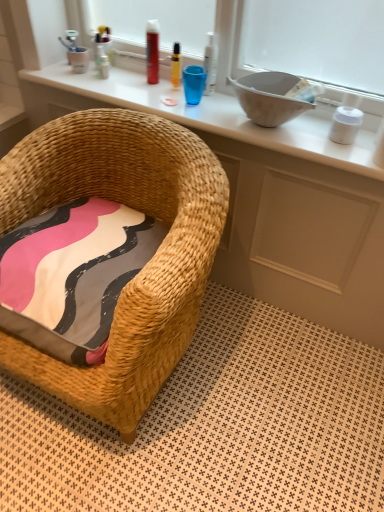
Question: Considering the relative positions of white matte container at upper right, marked as the 1th toiletry in a right-to-left arrangement, and woven wood changing table at upper center in the image provided, is white matte container at upper right, marked as the 1th toiletry in a right-to-left arrangement, to the right of woven wood changing table at upper center from the viewer's perspective?

Choices:
 (A) yes
 (B) no

Answer: (A)

Question: Does white matte container at upper right, which appears as the 5th toiletry when viewed from the left, have a larger size compared to woven wood changing table at upper center?

Choices:
 (A) yes
 (B) no

Answer: (B)

Question: Is white matte container at upper right, which appears as the 5th toiletry when viewed from the left, outside woven wood changing table at upper center?

Choices:
 (A) yes
 (B) no

Answer: (A)

Question: Can you confirm if white matte container at upper right, which appears as the 5th toiletry when viewed from the left, is taller than woven wood changing table at upper center?

Choices:
 (A) no
 (B) yes

Answer: (B)

Question: Are white matte container at upper right, marked as the 1th toiletry in a right-to-left arrangement, and woven wood changing table at upper center far apart?

Choices:
 (A) yes
 (B) no

Answer: (B)

Question: Is woven straw chair at lower left wider or thinner than matte wicker vanity at center?

Choices:
 (A) thin
 (B) wide

Answer: (B)

Question: In the image, is woven straw chair at lower left on the left side or the right side of matte wicker vanity at center?

Choices:
 (A) left
 (B) right

Answer: (A)

Question: In terms of height, does woven straw chair at lower left look taller or shorter compared to matte wicker vanity at center?

Choices:
 (A) short
 (B) tall

Answer: (B)

Question: From a real-world perspective, is woven straw chair at lower left positioned above or below matte wicker vanity at center?

Choices:
 (A) above
 (B) below

Answer: (A)

Question: Is translucent yellow bottle at upper center, placed as the third toiletry when sorted from right to left, wider or thinner than white plastic bottle at upper center, the 2th toiletry when ordered from right to left?

Choices:
 (A) wide
 (B) thin

Answer: (B)

Question: Considering their positions, is translucent yellow bottle at upper center, the third toiletry viewed from the left, located in front of or behind white plastic bottle at upper center, the 2th toiletry when ordered from right to left?

Choices:
 (A) behind
 (B) front

Answer: (A)

Question: Considering the positions of point (173, 83) and point (211, 35), is point (173, 83) closer or farther from the camera than point (211, 35)?

Choices:
 (A) closer
 (B) farther

Answer: (B)

Question: Considering the positions of translucent yellow bottle at upper center, placed as the third toiletry when sorted from right to left, and white plastic bottle at upper center, the fourth toiletry when ordered from left to right, in the image, is translucent yellow bottle at upper center, placed as the third toiletry when sorted from right to left, taller or shorter than white plastic bottle at upper center, the fourth toiletry when ordered from left to right,?

Choices:
 (A) tall
 (B) short

Answer: (B)

Question: Looking at their shapes, would you say pink fabric pillow at lower left is wider or thinner than white matte container at upper right, which appears as the 5th toiletry when viewed from the left?

Choices:
 (A) thin
 (B) wide

Answer: (B)

Question: From a real-world perspective, is pink fabric pillow at lower left physically located above or below white matte container at upper right, marked as the 1th toiletry in a right-to-left arrangement?

Choices:
 (A) above
 (B) below

Answer: (B)